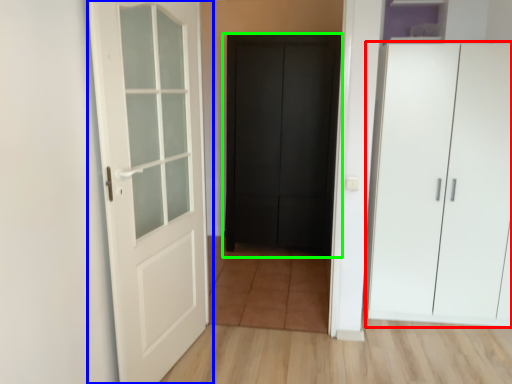
Question: Which object is positioned closest to cupboard (highlighted by a red box)? Select from door (highlighted by a blue box) and door (highlighted by a green box).

Choices:
 (A) door
 (B) door

Answer: (B)